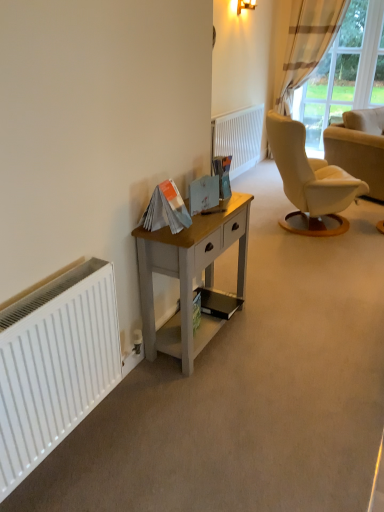
You are a GUI agent. You are given a task and a screenshot of the screen. Output one action in this format:
    pyautogui.click(x=<x>, y=<y>)
    Task: Click on the vacant region under white matte radiator at left, which is the first radiator from front to back (from a real-world perspective)
    
    Given the screenshot: What is the action you would take?
    pyautogui.click(x=75, y=438)